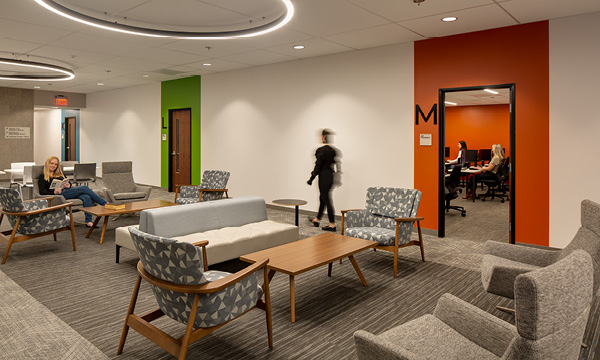
At what (x,y) coordinates should I click in order to perform the action: click on 2 white couches in center of image. Please return your answer as a coordinate pair (x, y). The image size is (600, 360). Looking at the image, I should click on (118, 241), (257, 227).